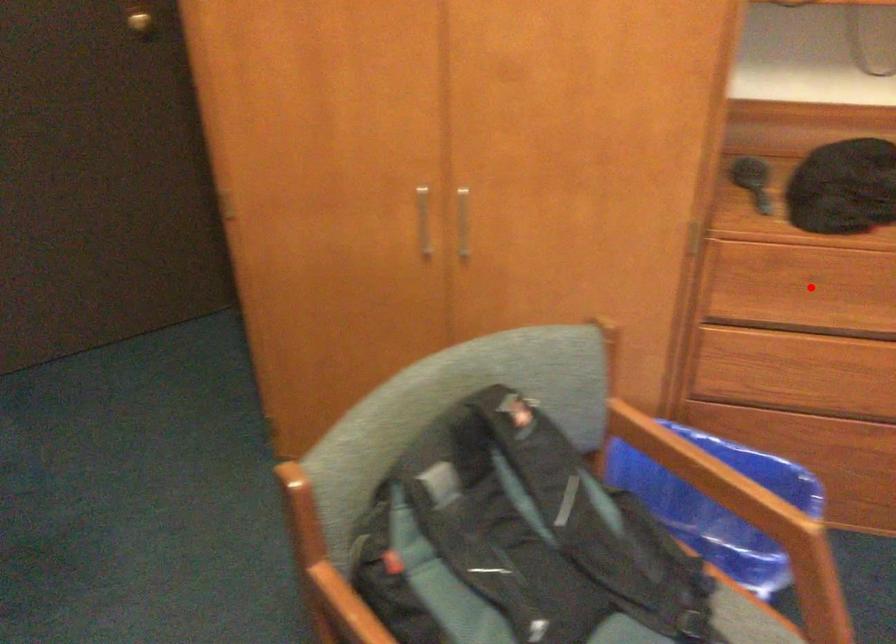
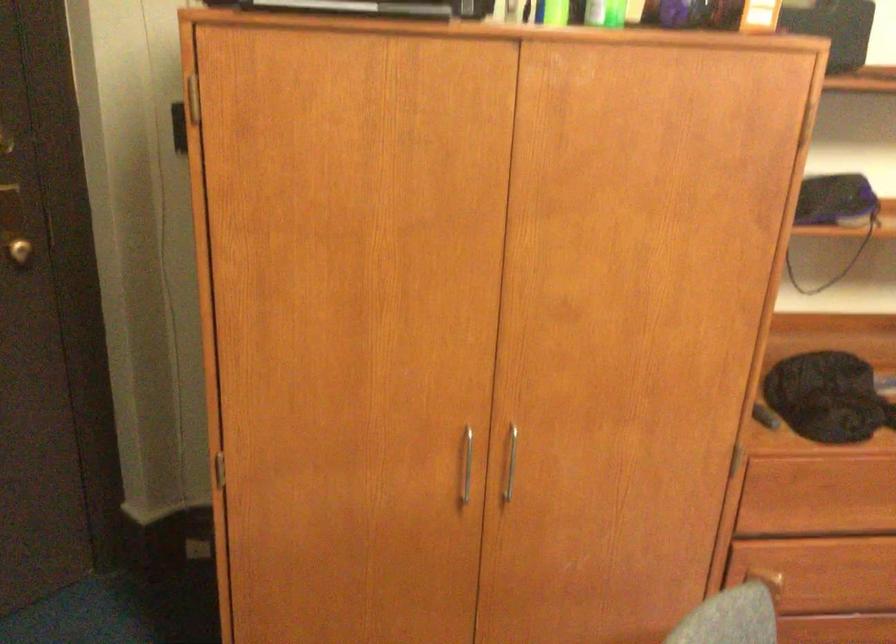
Find the pixel in the second image that matches the highlighted location in the first image.

(825, 495)